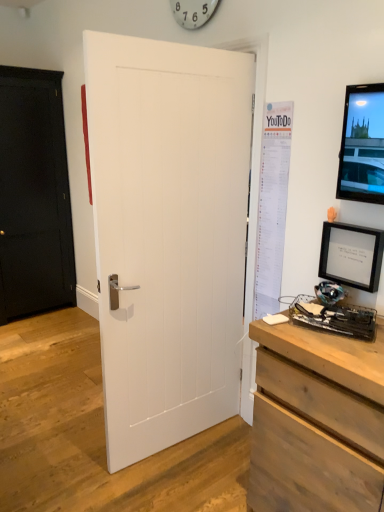
Question: From a real-world perspective, is white plastic clock at upper center on top of black matte door at left, acting as the second door starting from the front?

Choices:
 (A) yes
 (B) no

Answer: (A)

Question: Does white plastic clock at upper center turn towards black matte door at left, the second door viewed from the right?

Choices:
 (A) no
 (B) yes

Answer: (A)

Question: Can you see white plastic clock at upper center touching black matte door at left, the 1th door in the left-to-right sequence?

Choices:
 (A) no
 (B) yes

Answer: (A)

Question: Considering the relative positions of white plastic clock at upper center and black matte door at left, the second door viewed from the right, in the image provided, is white plastic clock at upper center to the right of black matte door at left, the second door viewed from the right, from the viewer's perspective?

Choices:
 (A) no
 (B) yes

Answer: (B)

Question: Can you confirm if white plastic clock at upper center is thinner than black matte door at left, the second door viewed from the right?

Choices:
 (A) yes
 (B) no

Answer: (A)

Question: Looking at their shapes, would you say metallic black desktop computer at lower right is wider or thinner than wooden chest of drawers at lower right?

Choices:
 (A) wide
 (B) thin

Answer: (B)

Question: Considering the relative positions of metallic black desktop computer at lower right and wooden chest of drawers at lower right in the image provided, is metallic black desktop computer at lower right to the left or to the right of wooden chest of drawers at lower right?

Choices:
 (A) right
 (B) left

Answer: (B)

Question: In terms of size, does metallic black desktop computer at lower right appear bigger or smaller than wooden chest of drawers at lower right?

Choices:
 (A) big
 (B) small

Answer: (B)

Question: Considering the positions of metallic black desktop computer at lower right and wooden chest of drawers at lower right in the image, is metallic black desktop computer at lower right taller or shorter than wooden chest of drawers at lower right?

Choices:
 (A) tall
 (B) short

Answer: (B)

Question: In terms of width, does white paper poster at right look wider or thinner when compared to metallic black desktop computer at lower right?

Choices:
 (A) thin
 (B) wide

Answer: (A)

Question: Choose the correct answer: Is white paper poster at right inside metallic black desktop computer at lower right or outside it?

Choices:
 (A) outside
 (B) inside

Answer: (A)

Question: Based on their sizes in the image, would you say white paper poster at right is bigger or smaller than metallic black desktop computer at lower right?

Choices:
 (A) big
 (B) small

Answer: (B)

Question: Considering their positions, is white paper poster at right located in front of or behind metallic black desktop computer at lower right?

Choices:
 (A) behind
 (B) front

Answer: (A)

Question: Does point (94, 133) appear closer or farther from the camera than point (347, 241)?

Choices:
 (A) farther
 (B) closer

Answer: (B)

Question: Considering the positions of white matte door at center, the second door in the back-to-front sequence, and black matte picture frame at right in the image, is white matte door at center, the second door in the back-to-front sequence, taller or shorter than black matte picture frame at right?

Choices:
 (A) short
 (B) tall

Answer: (B)